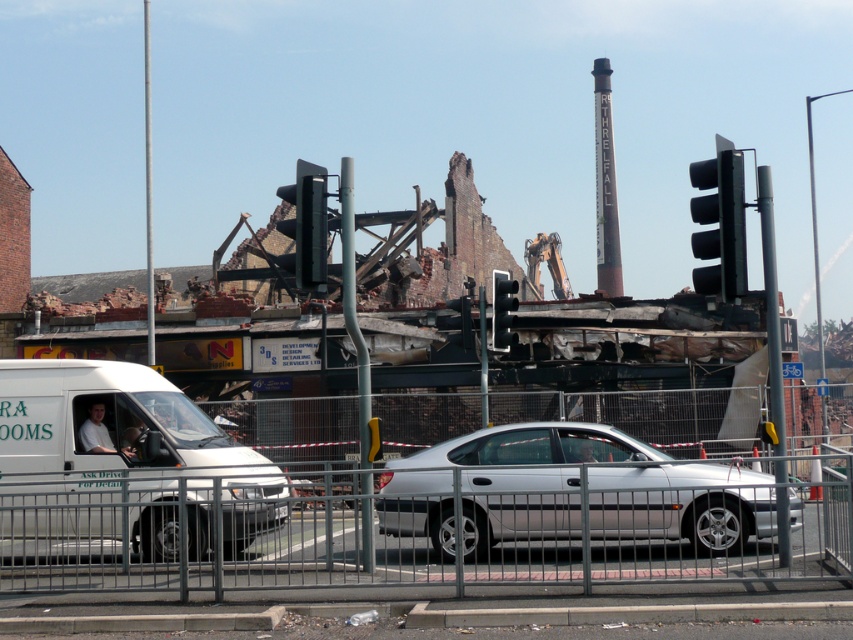
You are a delivery driver who needs to park your truck between the black plastic traffic light at upper right and the black matte traffic light at center. Your truck is 20 feet long. Can you fit your truck in that space?

The distance between the black plastic traffic light at upper right and the black matte traffic light at center is 26.77 feet. Since your truck is 20 feet long, there is enough space to park it between them.

You are a delivery driver who needs to park your van exactly 30 feet away from the black plastic traffic light at center. Can you park your white matte van at center in the current scene?

The white matte van at center and black plastic traffic light at center are 30.14 feet apart, so yes, you can park the white matte van at center since it is within the required distance of 30 feet.